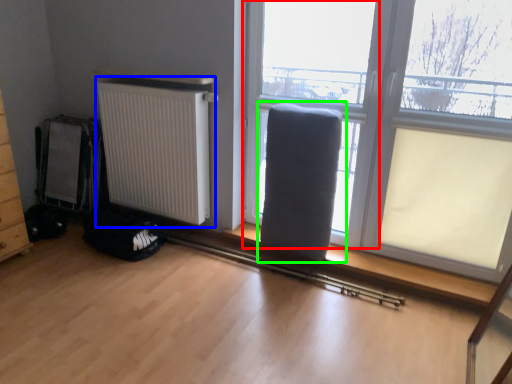
Question: Which object is the closest to the window frame (highlighted by a red box)? Choose among these: radiator (highlighted by a blue box) or armchair (highlighted by a green box).

Choices:
 (A) radiator
 (B) armchair

Answer: (B)